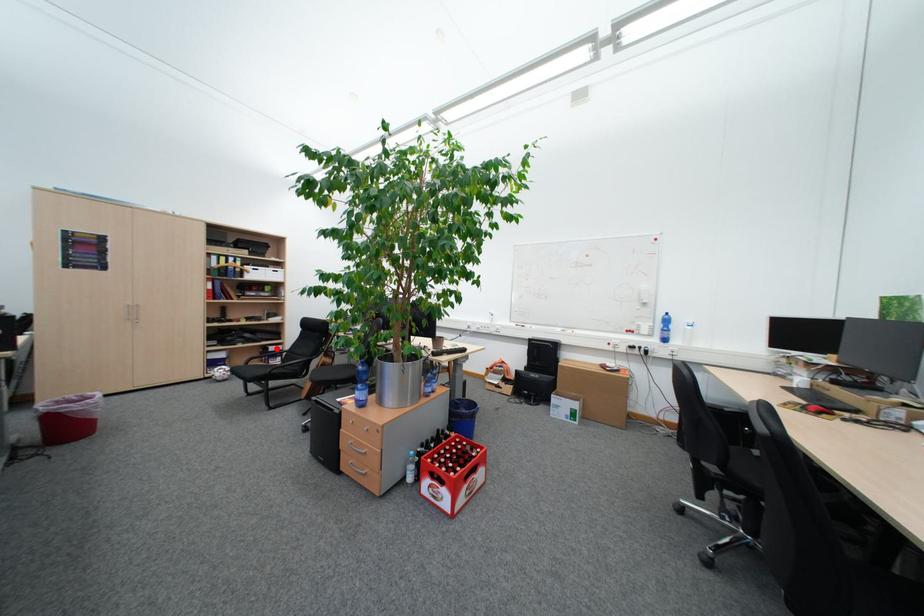
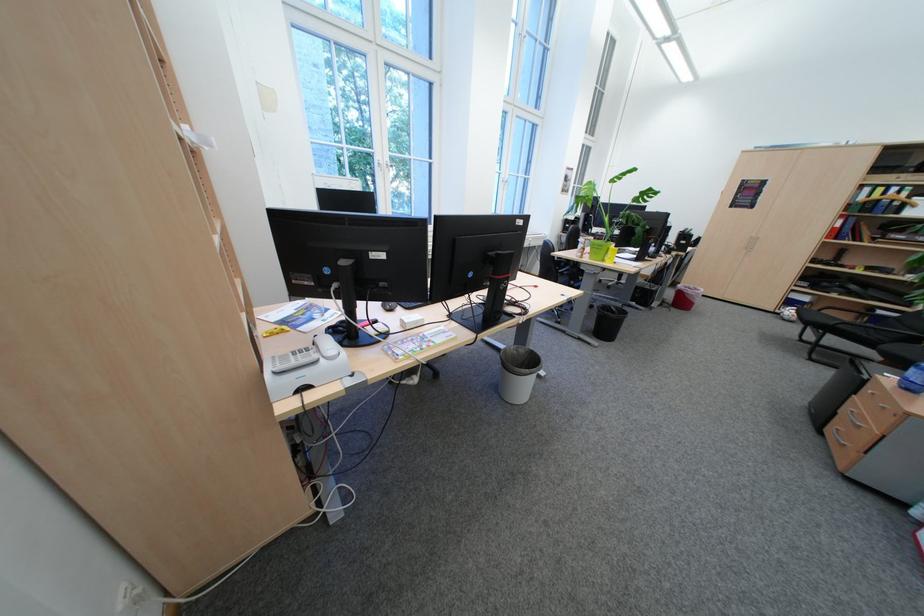
Locate, in the second image, the point that corresponds to the highlighted location in the first image.

(881, 310)